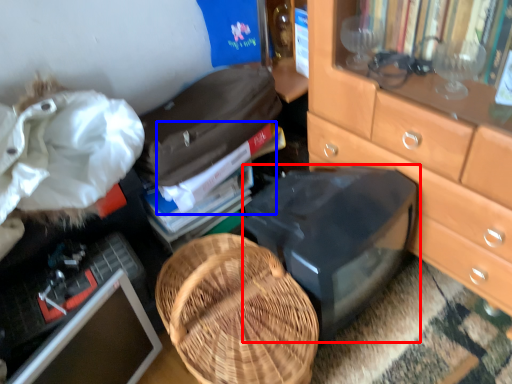
Question: Which object is further to the camera taking this photo, desktop (highlighted by a red box) or book (highlighted by a blue box)?

Choices:
 (A) desktop
 (B) book

Answer: (B)